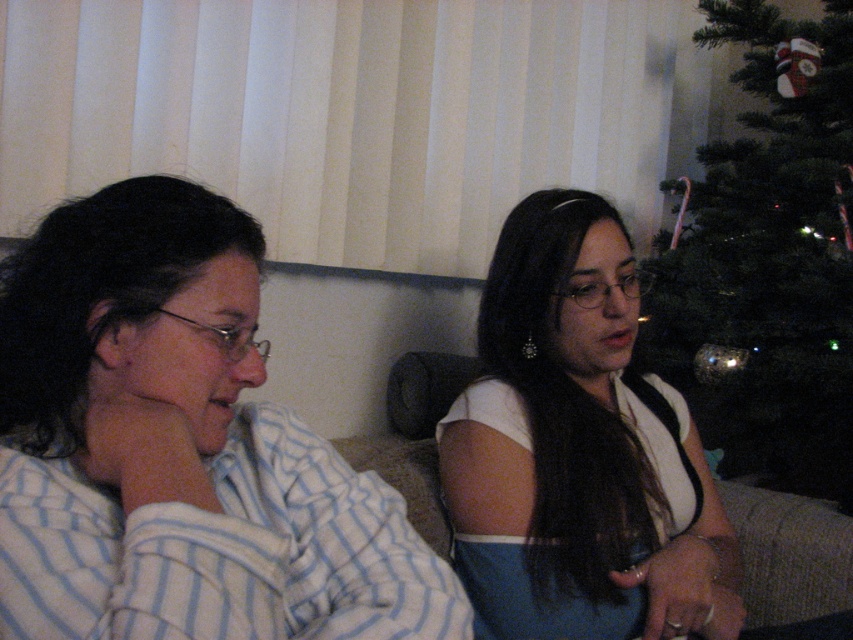
Question: Which of the following is the closest to the observer?

Choices:
 (A) (735, 237)
 (B) (97, 257)

Answer: (B)

Question: Observing the image, what is the correct spatial positioning of white striped pajamas at left in reference to green matte christmas tree at right?

Choices:
 (A) above
 (B) below

Answer: (B)

Question: Is the position of white striped pajamas at left more distant than that of green matte christmas tree at right?

Choices:
 (A) no
 (B) yes

Answer: (A)

Question: Observing the image, what is the correct spatial positioning of white fabric dress at center in reference to green matte christmas tree at right?

Choices:
 (A) above
 (B) below

Answer: (B)

Question: Which point is farther to the camera?

Choices:
 (A) (631, 476)
 (B) (683, 259)

Answer: (B)

Question: Which is farther from the white fabric dress at center?

Choices:
 (A) white striped pajamas at left
 (B) green matte christmas tree at right

Answer: (B)